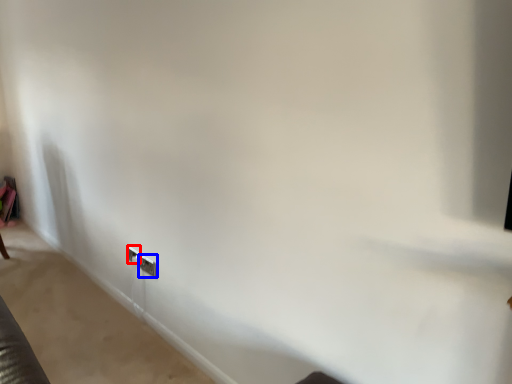
Question: Which of the following is the closest to the observer, electric outlet (highlighted by a red box) or electric outlet (highlighted by a blue box)?

Choices:
 (A) electric outlet
 (B) electric outlet

Answer: (B)